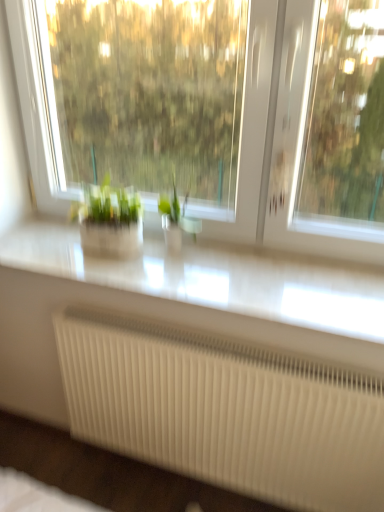
I want to click on unoccupied area in front of green matte plant at center, so click(x=179, y=272).